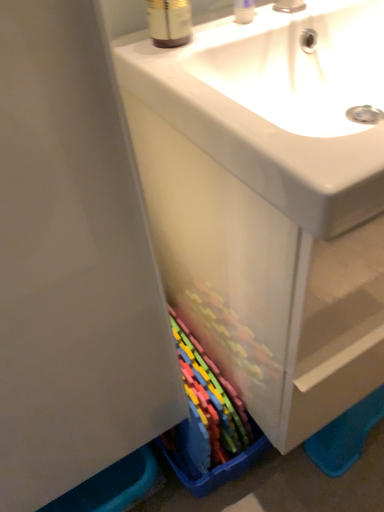
In order to click on vacant space that's between clear plastic container at upper center and brown plastic bottle at upper center in this screenshot , I will do coord(212,25).